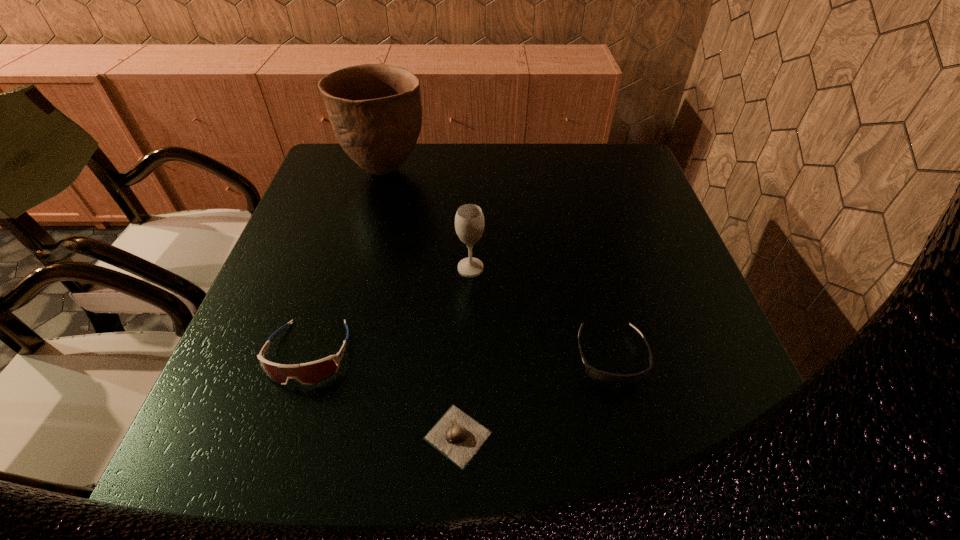
Image resolution: width=960 pixels, height=540 pixels. Identify the location of object that is at the far left corner. (375, 110).

This screenshot has width=960, height=540. What are the coordinates of `vacant space at the far edge of the desktop` in the screenshot? It's located at (459, 144).

The height and width of the screenshot is (540, 960). What are the coordinates of `vacant area at the near edge` in the screenshot? It's located at (635, 448).

The width and height of the screenshot is (960, 540). Find the location of `vacant point at the left edge`. vacant point at the left edge is located at coordinates (270, 436).

Image resolution: width=960 pixels, height=540 pixels. Identify the location of free space at the right edge of the desktop. (668, 327).

The image size is (960, 540). What are the coordinates of `free spot at the far left corner of the desktop` in the screenshot? It's located at (337, 168).

Locate an element on the screen. Image resolution: width=960 pixels, height=540 pixels. free space between the pottery and the fourth shortest object is located at coordinates (428, 219).

This screenshot has height=540, width=960. Identify the location of unoccupied position between the left goggles and the second tallest object. (390, 311).

Where is `empty location between the garlic and the left goggles`? The height and width of the screenshot is (540, 960). empty location between the garlic and the left goggles is located at coordinates (383, 395).

Find the location of a particular element. empty space between the fourth nearest object and the shortest object is located at coordinates (465, 352).